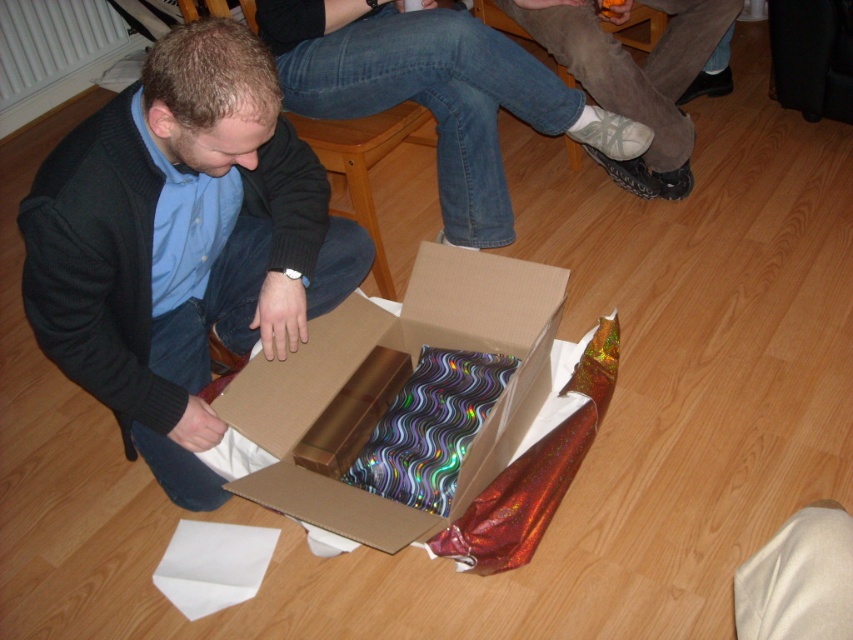
You are helping to organize items in a room. You see the cardboard box at lower center and the white mesh socks at lower center. Which item is positioned lower in the image?

The cardboard box at lower center is positioned lower than the white mesh socks at lower center.

You are organizing a closet and need to place the matte black sweater at lower left and the white mesh socks at lower center. According to their positions, which item should you place first to maintain the correct order?

The matte black sweater at lower left should be placed first since it is to the left of the white mesh socks at lower center.